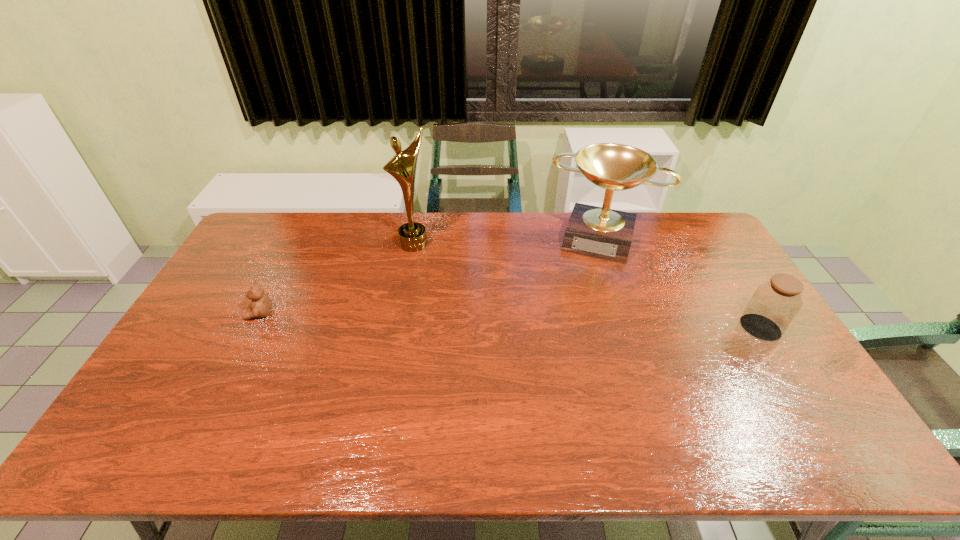
Locate an element on the screen. Image resolution: width=960 pixels, height=540 pixels. free point between the third tallest object and the shorter award is located at coordinates (681, 283).

Image resolution: width=960 pixels, height=540 pixels. I want to click on empty space that is in between the tallest object and the teddy bear, so click(337, 279).

Locate an element on the screen. The height and width of the screenshot is (540, 960). free space between the third tallest object and the tallest object is located at coordinates (588, 286).

Where is `free space between the shortest object and the left award`? This screenshot has width=960, height=540. free space between the shortest object and the left award is located at coordinates (337, 279).

Locate which object ranks third in proximity to the third object from right to left. Please provide its 2D coordinates. Your answer should be formatted as a tuple, i.e. [(x, y)], where the tuple contains the x and y coordinates of a point satisfying the conditions above.

[(774, 304)]

Find the location of a particular element. The height and width of the screenshot is (540, 960). object identified as the second closest to the second shortest object is located at coordinates (412, 236).

At what (x,y) coordinates should I click in order to perform the action: click on vacant region that satisfies the following two spatial constraints: 1. on the front side of the right award; 2. on the right side of the jar. Please return your answer as a coordinate pair (x, y). Looking at the image, I should click on (632, 328).

Locate an element on the screen. Image resolution: width=960 pixels, height=540 pixels. vacant point that satisfies the following two spatial constraints: 1. on the back side of the third object from right to left; 2. on the left side of the shorter award is located at coordinates (416, 238).